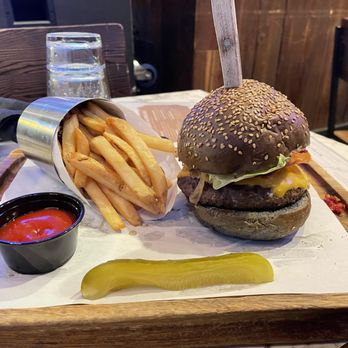
Find the location of a particular element. The image size is (348, 348). edge of table is located at coordinates (193, 313).